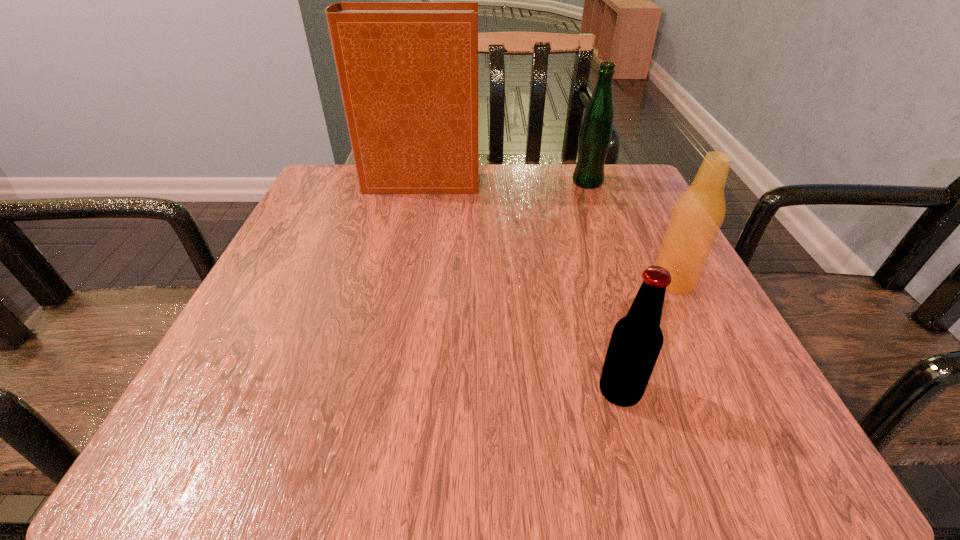
Where is `hardback book located in the far edge section of the desktop`? This screenshot has width=960, height=540. hardback book located in the far edge section of the desktop is located at coordinates (408, 71).

This screenshot has height=540, width=960. Identify the location of beer bottle that is at the far edge. (595, 136).

Where is `object located at the near edge`? object located at the near edge is located at coordinates (636, 341).

This screenshot has height=540, width=960. I want to click on object positioned at the left edge, so click(408, 71).

Where is `object at the far left corner`? object at the far left corner is located at coordinates (408, 71).

Where is `object present at the far right corner`? This screenshot has width=960, height=540. object present at the far right corner is located at coordinates (595, 136).

Locate an element on the screen. The image size is (960, 540). object that is at the near right corner is located at coordinates (636, 341).

Locate an element on the screen. vacant area at the far edge of the desktop is located at coordinates (458, 212).

I want to click on free point at the near edge, so click(545, 411).

Locate an element on the screen. free region at the left edge is located at coordinates (305, 240).